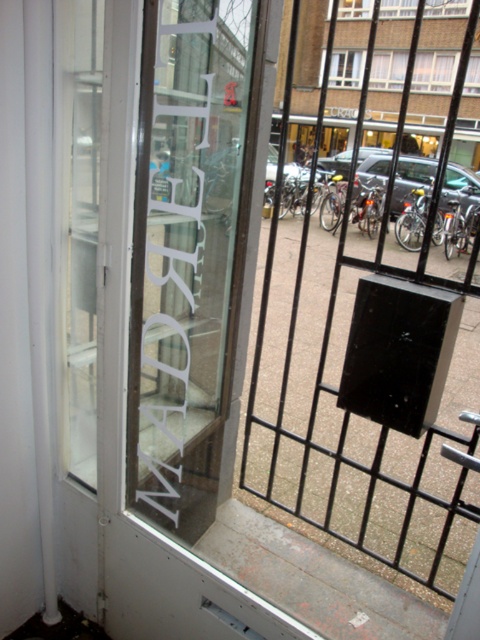
The width and height of the screenshot is (480, 640). Describe the element at coordinates (189, 250) in the screenshot. I see `transparent glass sign at upper left` at that location.

Which is behind, point (204, 380) or point (387, 74)?

Positioned behind is point (387, 74).

Does point (189, 371) lie behind point (340, 68)?

No.

Locate an element on the screen. Image resolution: width=480 pixels, height=640 pixels. transparent glass sign at upper left is located at coordinates (189, 250).

Locate an element on the screen. The height and width of the screenshot is (640, 480). white plastic window at upper center is located at coordinates (433, 72).

Who is more distant from viewer, (435, 60) or (391, 4)?

The point (435, 60) is more distant.

Who is more forward, (432, 83) or (446, 8)?

Point (446, 8) is more forward.

Image resolution: width=480 pixels, height=640 pixels. Identify the location of white plastic window at upper center. (433, 72).

Which is in front, point (348, 173) or point (391, 8)?

Point (348, 173) is in front.

Which is behind, point (315, 17) or point (339, 12)?

The point (339, 12) is behind.

Between point (283, 404) and point (397, 12), which one is positioned behind?

The point (397, 12) is more distant.

This screenshot has width=480, height=640. I want to click on transparent glass door at center, so click(368, 284).